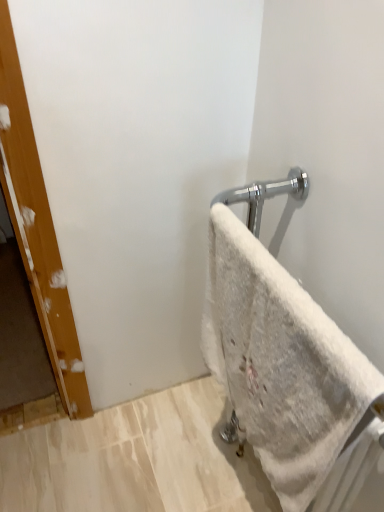
Measure the distance between white fluffy towel at right and camera.

A distance of 19.48 inches exists between white fluffy towel at right and camera.

Describe the element at coordinates (286, 372) in the screenshot. This screenshot has width=384, height=512. I see `white fluffy towel at right` at that location.

This screenshot has height=512, width=384. In order to click on white fluffy towel at right in this screenshot , I will do `click(286, 372)`.

You are a GUI agent. You are given a task and a screenshot of the screen. Output one action in this format:
    pyautogui.click(x=<x>, y=<y>)
    Task: Click on the white fluffy towel at right
    The image size is (384, 512).
    Given the screenshot: What is the action you would take?
    pyautogui.click(x=286, y=372)